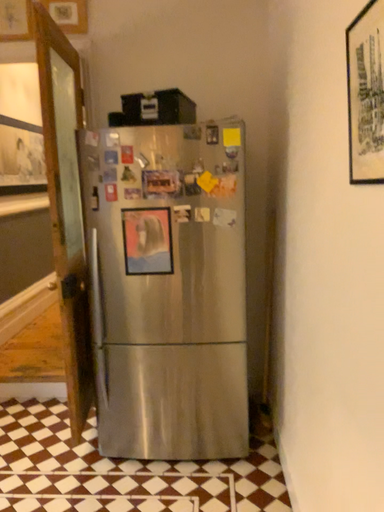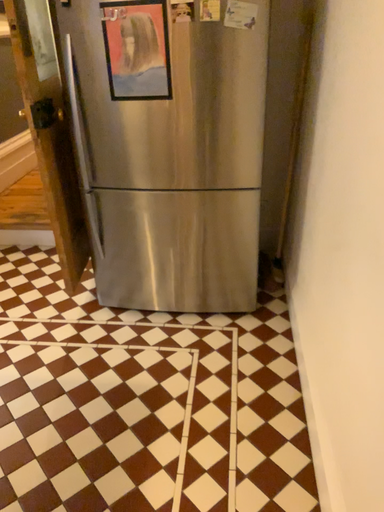
Question: Which way did the camera rotate in the video?

Choices:
 (A) rotated downward
 (B) rotated upward

Answer: (A)